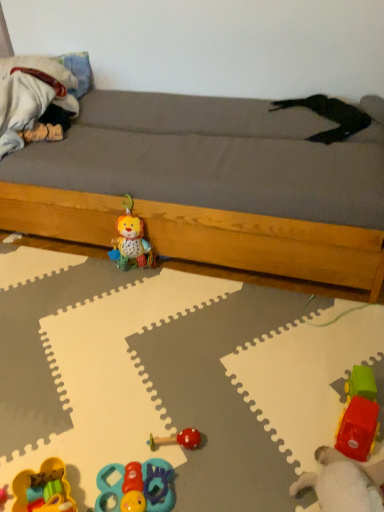
Identify the location of empty space that is in between smooth plastic rattle at center, acting as the fourth toy starting from the left, and rubberized plastic car at lower right, the fifth toy when ordered from left to right. This screenshot has width=384, height=512. pos(236,461).